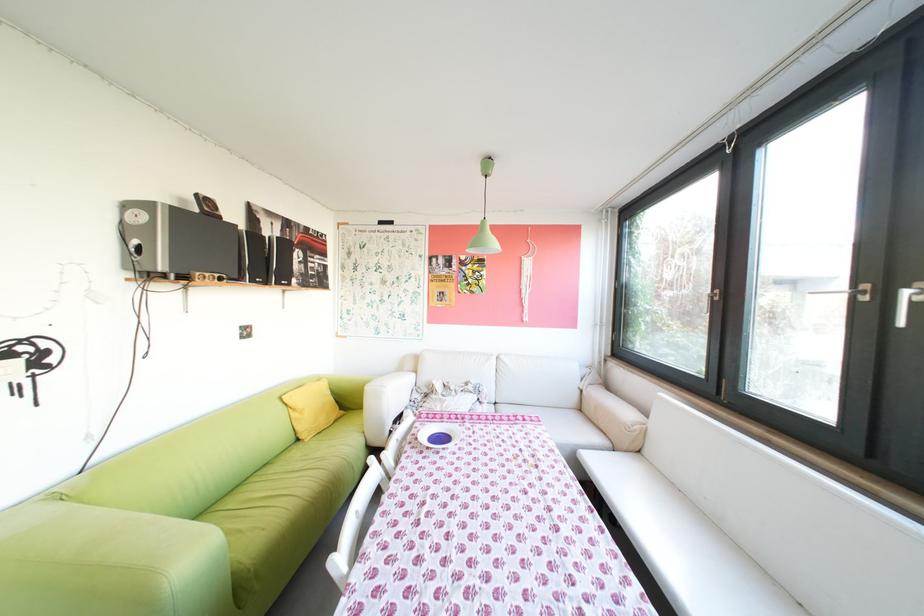
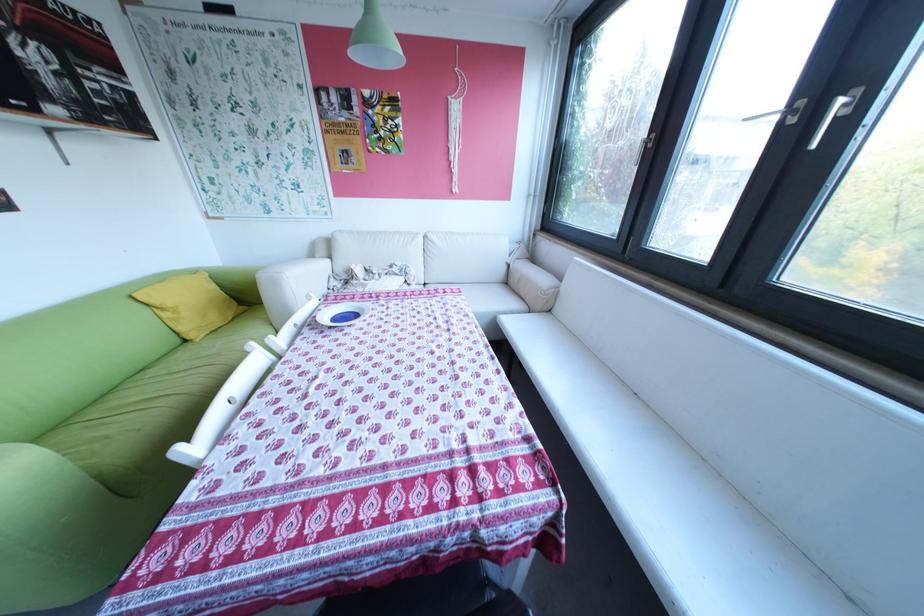
In the second image, find the point that corresponds to point 430,424 in the first image.

(334, 307)